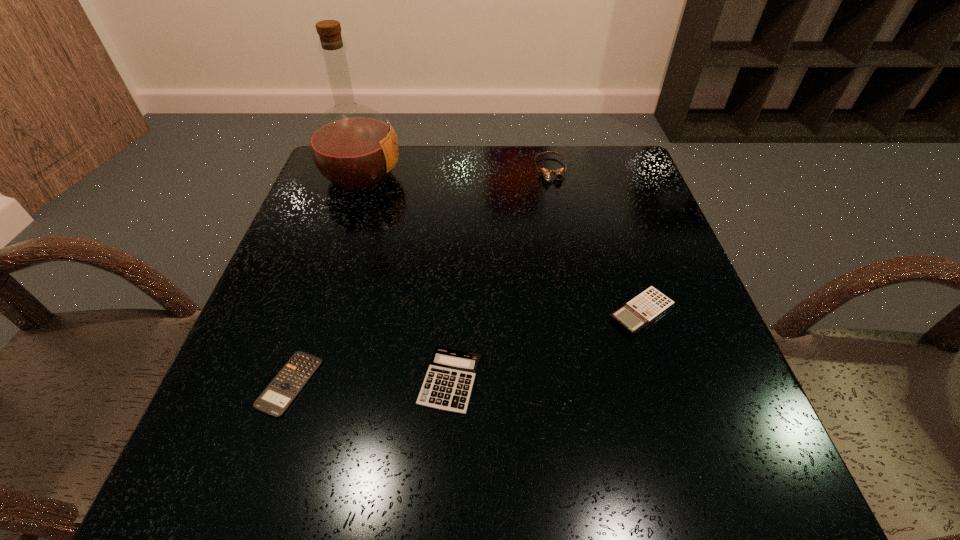
In order to click on vacant region that satisfies the following two spatial constraints: 1. on the front lenses and sides of the goggles; 2. on the left side of the rightmost calculator in this screenshot , I will do click(x=579, y=312).

The image size is (960, 540). Find the location of `vacant space that satisfies the following two spatial constraints: 1. on the back side of the shortest object; 2. on the left side of the second calculator from left to right`. vacant space that satisfies the following two spatial constraints: 1. on the back side of the shortest object; 2. on the left side of the second calculator from left to right is located at coordinates (291, 381).

The image size is (960, 540). In order to click on vacant area in the image that satisfies the following two spatial constraints: 1. on the front lenses and sides of the fourth object from left to right; 2. on the right side of the rightmost object in this screenshot , I will do `click(579, 312)`.